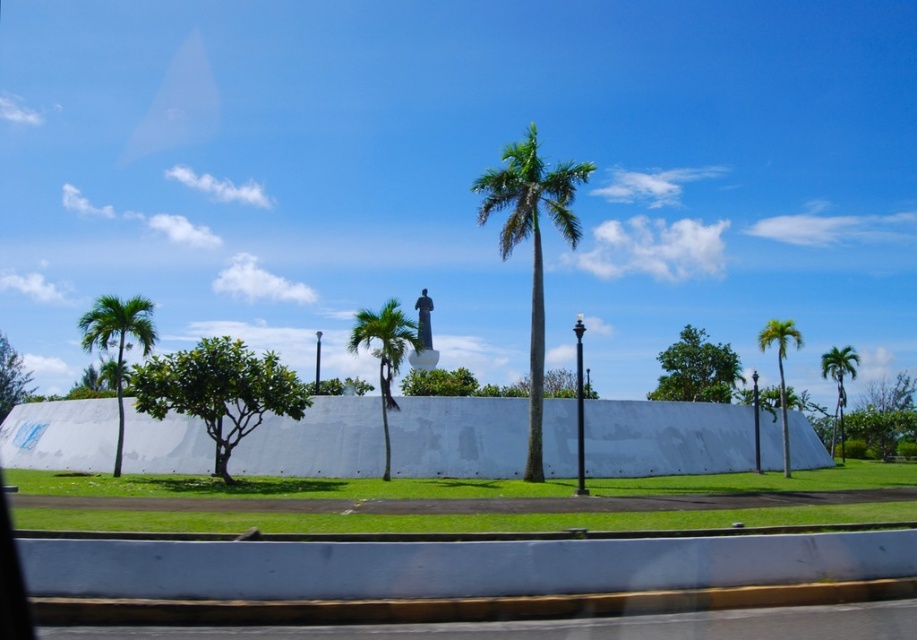
Question: Which of the following is the closest to the observer?

Choices:
 (A) green leafy palm tree at left
 (B) green leafy tree at left
 (C) green leafy palm tree at center-right
 (D) green leafy tree at center

Answer: (D)

Question: Among these objects, which one is nearest to the camera?

Choices:
 (A) green leafy palm tree at right
 (B) green leafy palm at center

Answer: (B)

Question: Can you confirm if green leafy tree at center is positioned below green leafy palm tree at center?

Choices:
 (A) no
 (B) yes

Answer: (B)

Question: Which of the following is the closest to the observer?

Choices:
 (A) green leafy tree at upper center
 (B) green leafy palm tree at left

Answer: (B)

Question: Does green leafy tree at upper center appear on the left side of green leafy palm tree at center-right?

Choices:
 (A) yes
 (B) no

Answer: (A)

Question: Does green leafy palm tree at left come in front of green leafy palm tree at center?

Choices:
 (A) yes
 (B) no

Answer: (B)